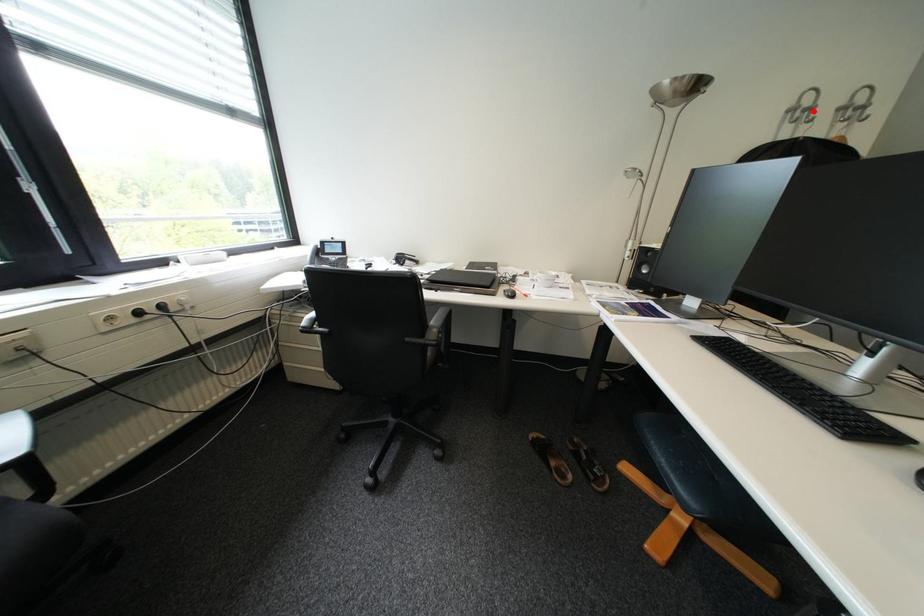
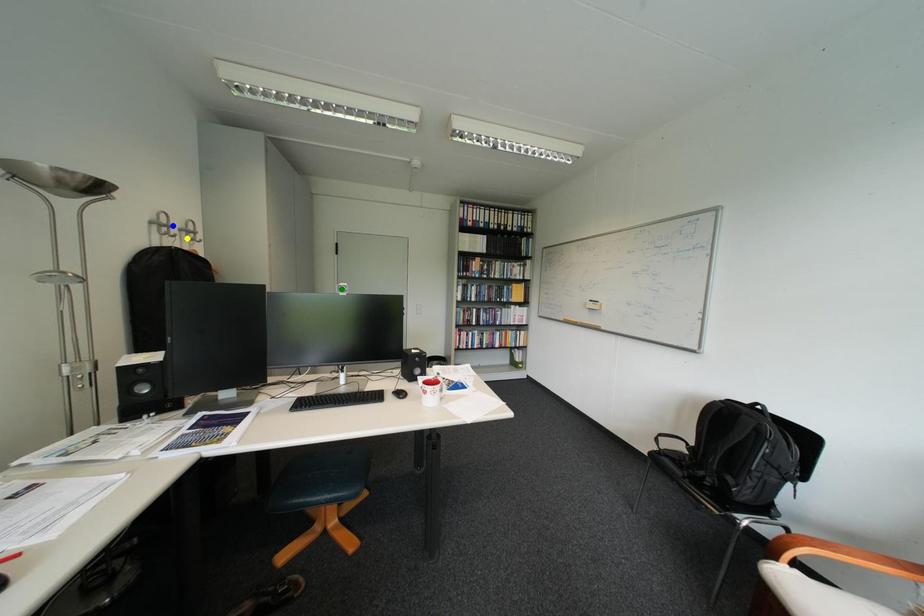
Question: I am providing you with two images of the same scene from different viewpoints. A red point is marked on the first image. You are given multiple points on the second image. Which mark in image 2 goes with the point in image 1?

Choices:
 (A) green point
 (B) blue point
 (C) yellow point

Answer: (B)